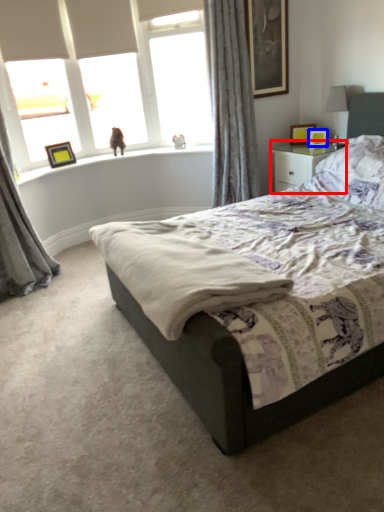
Question: Which object is further to the camera taking this photo, nightstand (highlighted by a red box) or picture frame (highlighted by a blue box)?

Choices:
 (A) nightstand
 (B) picture frame

Answer: (B)